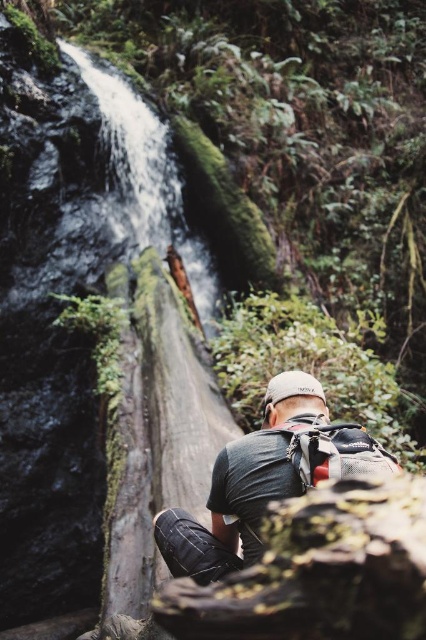
Question: Which object appears closest to the camera in this image?

Choices:
 (A) dark gray fabric backpack at center
 (B) green mossy tree trunk at center

Answer: (A)

Question: Is green mossy tree trunk at center closer to the viewer compared to dark gray fabric backpack at center?

Choices:
 (A) no
 (B) yes

Answer: (A)

Question: Observing the image, what is the correct spatial positioning of green mossy tree trunk at center in reference to dark gray fabric backpack at center?

Choices:
 (A) right
 (B) left

Answer: (B)

Question: Does green mossy tree trunk at center have a greater width compared to dark gray fabric backpack at center?

Choices:
 (A) no
 (B) yes

Answer: (B)